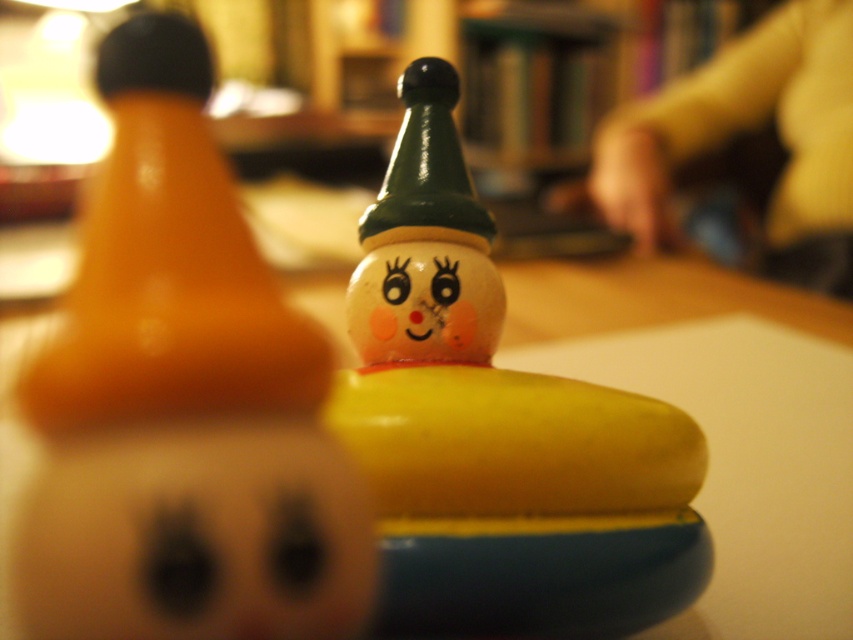
Question: Is matte yellow face at center bigger than matte plastic face at center?

Choices:
 (A) no
 (B) yes

Answer: (B)

Question: Which point appears farthest from the camera in this image?

Choices:
 (A) (351, 333)
 (B) (132, 74)
 (C) (601, 394)

Answer: (A)

Question: Which point is closer to the camera?

Choices:
 (A) (363, 317)
 (B) (372, 307)
 (C) (262, 496)

Answer: (C)

Question: Based on their relative distances, which object is nearer to the matte orange rubber duck at left?

Choices:
 (A) wooden clown at center
 (B) matte plastic face at center
 (C) matte yellow face at center

Answer: (C)

Question: Is wooden clown at center below matte plastic face at center?

Choices:
 (A) yes
 (B) no

Answer: (B)

Question: Is matte orange rubber duck at left to the right of matte plastic face at center from the viewer's perspective?

Choices:
 (A) yes
 (B) no

Answer: (B)